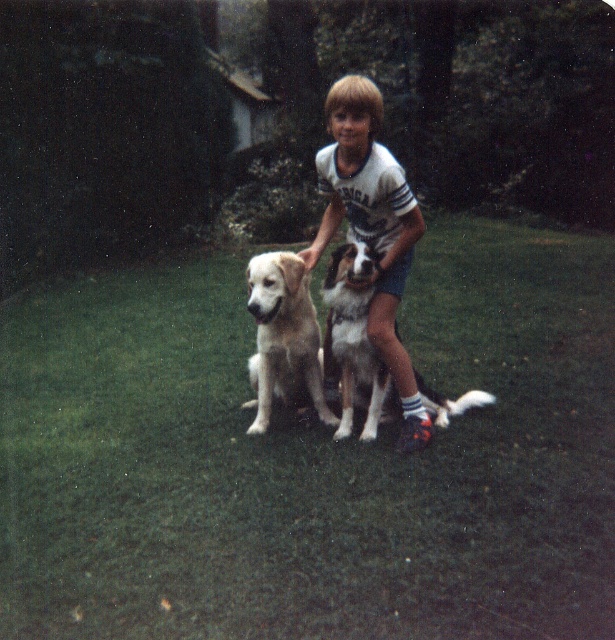
Is point (159, 508) positioned after point (338, 273)?

No, it is not.

Does green grass at center appear over white fur dog at center?

No, green grass at center is not above white fur dog at center.

Which is in front, point (383, 452) or point (336, 330)?

Point (383, 452) is in front.

Identify the location of green grass at center. This screenshot has width=615, height=640. [x=311, y=458].

Consider the image. Who is shorter, green grass at center or light brown fur at center?

Standing shorter between the two is green grass at center.

Between point (341, 584) and point (258, 410), which one is positioned behind?

Positioned behind is point (258, 410).

This screenshot has height=640, width=615. What are the coordinates of `green grass at center` in the screenshot? It's located at pyautogui.click(x=311, y=458).

Who is positioned more to the right, white cotton shirt at center or light brown fur at center?

white cotton shirt at center is more to the right.

Which is below, white cotton shirt at center or light brown fur at center?

light brown fur at center is lower down.

You are a GUI agent. You are given a task and a screenshot of the screen. Output one action in this format:
    pyautogui.click(x=<x>, y=<y>)
    Task: Click on the white cotton shirt at center
    The image size is (615, 640).
    Given the screenshot: What is the action you would take?
    pyautogui.click(x=373, y=227)